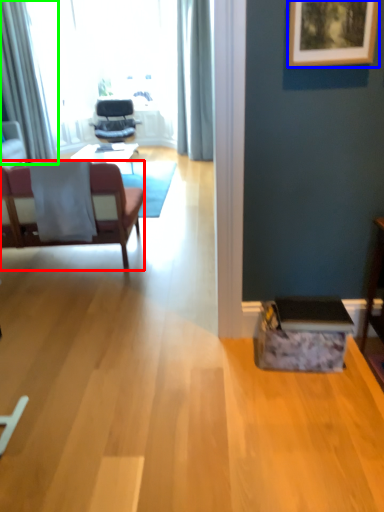
Question: Considering the real-world distances, which object is closest to chair (highlighted by a red box)? picture frame (highlighted by a blue box) or curtain (highlighted by a green box).

Choices:
 (A) picture frame
 (B) curtain

Answer: (B)